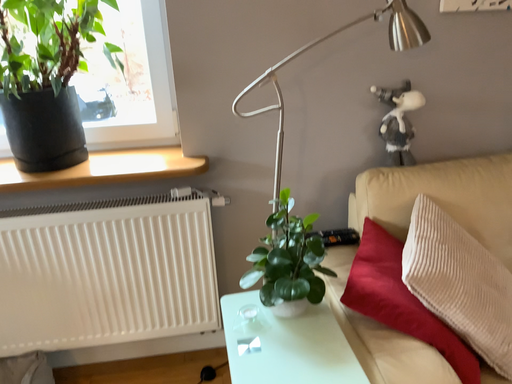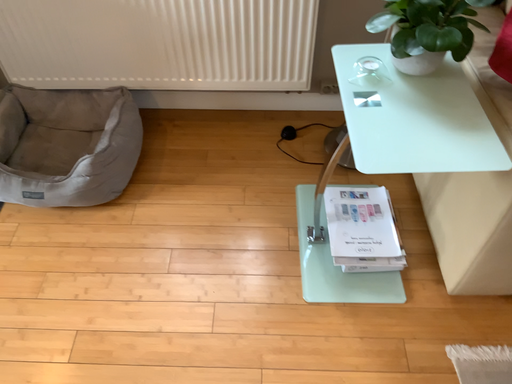
Question: How did the camera likely rotate when shooting the video?

Choices:
 (A) rotated right
 (B) rotated left

Answer: (B)